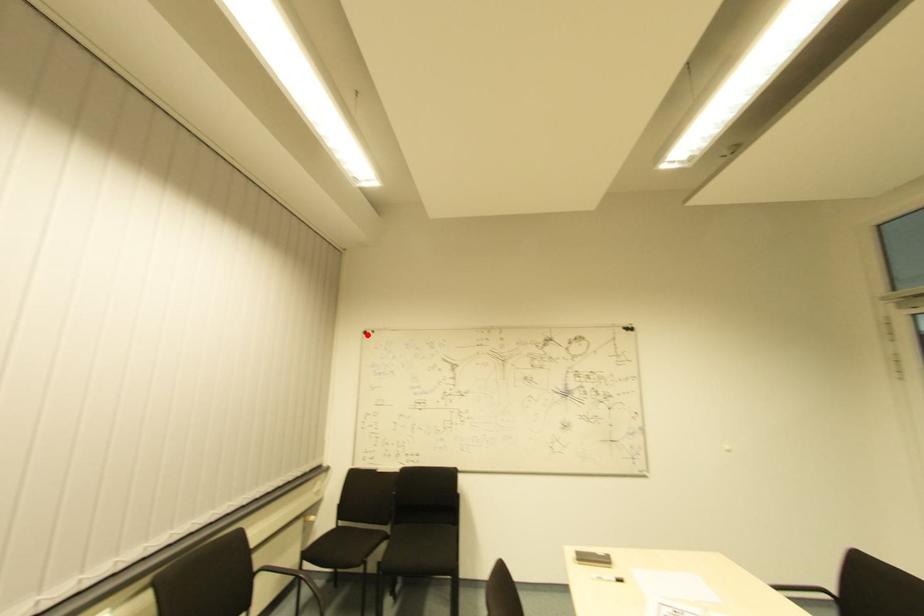
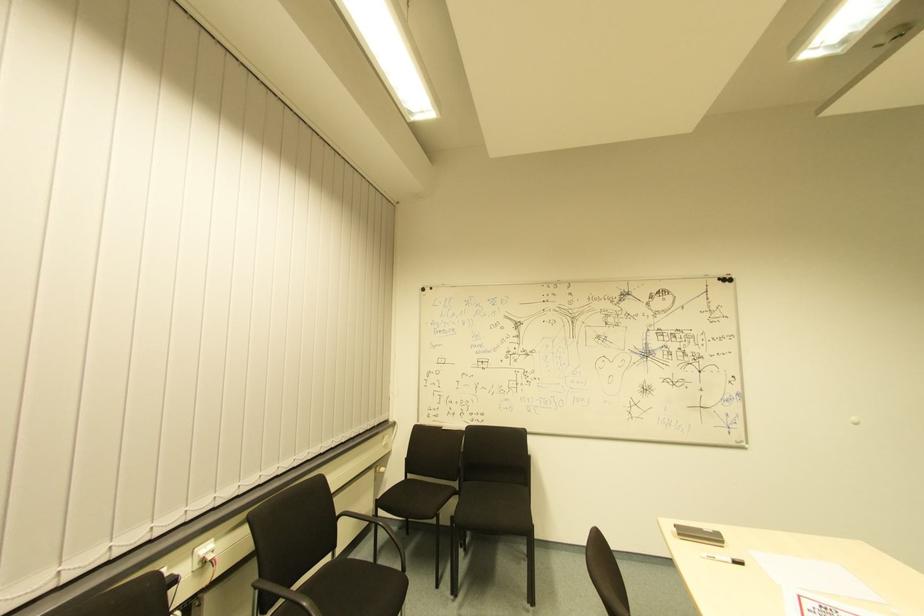
In the second image, find the point that corresponds to the highlighted location in the first image.

(427, 293)